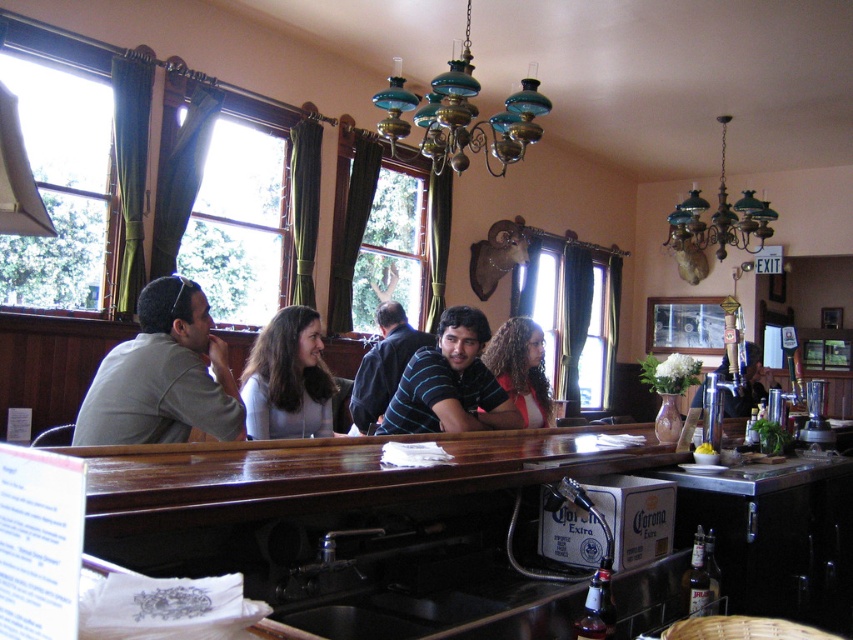
You are standing at the entrance of the bar and want to sit at the wooden bar counter at center. Which direction should you walk to reach it?

Since the wooden bar counter at center is located at point 0.834 on the x and 0.535 on the y, you should walk forward and to the right to reach it.

You are a bartender preparing to place a drink order on the wooden bar counter at center and the curly hair at bar. Which object should you avoid placing drinks on to ensure they are stable?

The curly hair at bar is not a stable surface for placing drinks, so you should avoid placing drinks there and instead use the wooden bar counter at center which is a solid surface.

You are a person standing at the entrance of the bar. You see two shirts on the bar counter. The gray cotton shirt at left and the striped shirt at center. Which shirt is shorter?

The gray cotton shirt at left is shorter than the striped shirt at center.